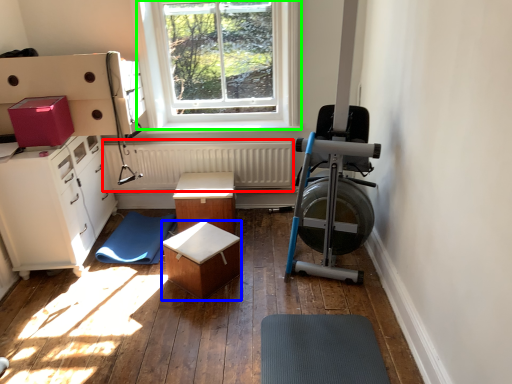
Question: Which is nearer to the radiator (highlighted by a red box)? table (highlighted by a blue box) or window (highlighted by a green box).

Choices:
 (A) table
 (B) window

Answer: (B)